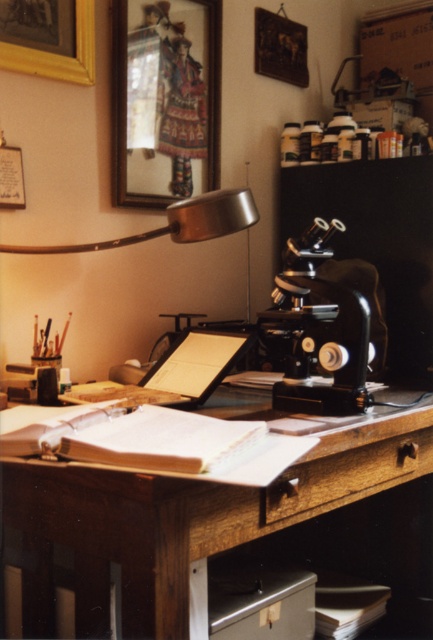
Is wooden framed picture at upper left positioned in front of black metal microscope at center?

No.

Can you confirm if wooden framed picture at upper left is positioned to the right of black metal microscope at center?

No, wooden framed picture at upper left is not to the right of black metal microscope at center.

Is point (161, 198) closer to camera compared to point (336, 353)?

That is False.

Image resolution: width=433 pixels, height=640 pixels. What are the coordinates of `wooden framed picture at upper left` in the screenshot? It's located at (165, 99).

Describe the element at coordinates (187, 520) in the screenshot. I see `brown wooden table at center` at that location.

Can you confirm if brown wooden table at center is smaller than gold wooden picture frame at upper left?

Incorrect, brown wooden table at center is not smaller in size than gold wooden picture frame at upper left.

Is point (197, 584) farther from viewer compared to point (77, 44)?

That is False.

Find the location of a particular element. The image size is (433, 640). brown wooden table at center is located at coordinates (187, 520).

Does wooden framed picture at upper left appear under gold wooden picture frame at upper left?

Yes, wooden framed picture at upper left is below gold wooden picture frame at upper left.

How far apart are wooden framed picture at upper left and gold wooden picture frame at upper left?

wooden framed picture at upper left is 24.27 centimeters from gold wooden picture frame at upper left.

Is point (157, 124) more distant than point (12, 52)?

Yes.

This screenshot has width=433, height=640. I want to click on wooden framed picture at upper left, so click(165, 99).